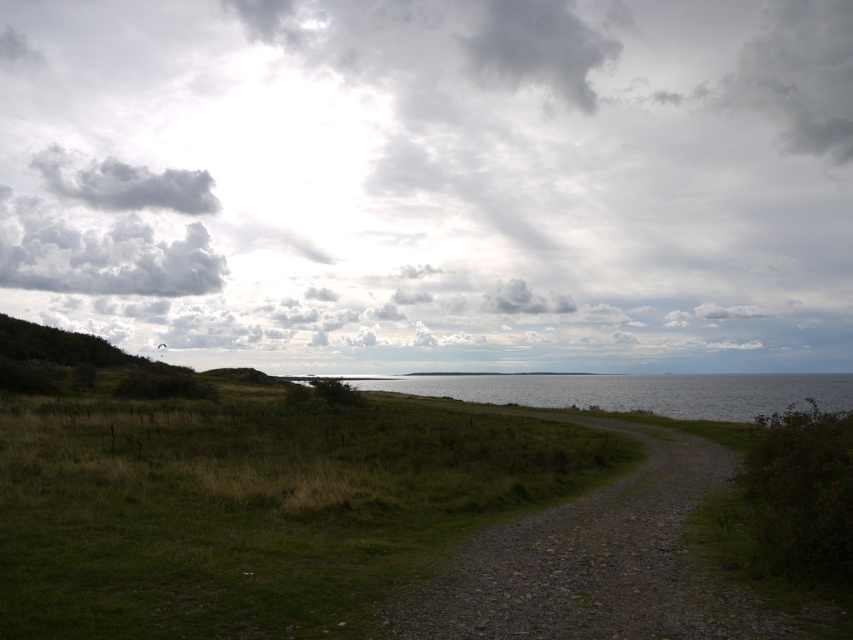
Question: Can you confirm if cloudy sky at upper center is positioned above gray fluffy cloud at upper right?

Choices:
 (A) yes
 (B) no

Answer: (B)

Question: Which object appears closest to the camera in this image?

Choices:
 (A) cloudy white cloud at upper left
 (B) green grassy at lower left
 (C) gray fluffy cloud at upper center
 (D) gray fluffy cloud at upper left

Answer: (B)

Question: Does clear water at center appear under gray fluffy cloud at upper center?

Choices:
 (A) no
 (B) yes

Answer: (B)

Question: Among these objects, which one is nearest to the camera?

Choices:
 (A) clear water at center
 (B) cloudy sky at upper center

Answer: (A)

Question: Among these points, which one is farthest from the camera?

Choices:
 (A) (241, 499)
 (B) (770, 45)

Answer: (B)

Question: Does clear water at center have a larger size compared to gray fluffy cloud at upper right?

Choices:
 (A) no
 (B) yes

Answer: (B)